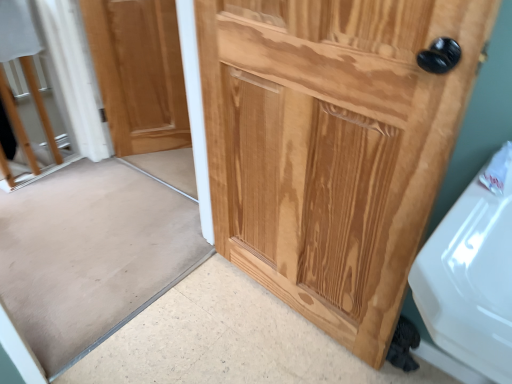
Question: Do you think natural wood door at upper left, which is counted as the 1th door, starting from the left, is within natural wood screen door at center, or outside of it?

Choices:
 (A) outside
 (B) inside

Answer: (A)

Question: In the image, is natural wood door at upper left, which is counted as the second door, starting from the front, positioned in front of or behind natural wood screen door at center?

Choices:
 (A) front
 (B) behind

Answer: (B)

Question: Estimate the real-world distances between objects in this image. Which object is closer to the natural wood screen door at center?

Choices:
 (A) natural wood door at upper left, the second door viewed from the right
 (B) natural wood door at right, acting as the first door starting from the right

Answer: (A)

Question: Which object is positioned farthest from the natural wood door at right, acting as the first door starting from the right?

Choices:
 (A) natural wood screen door at center
 (B) natural wood door at upper left, the second door viewed from the right

Answer: (B)